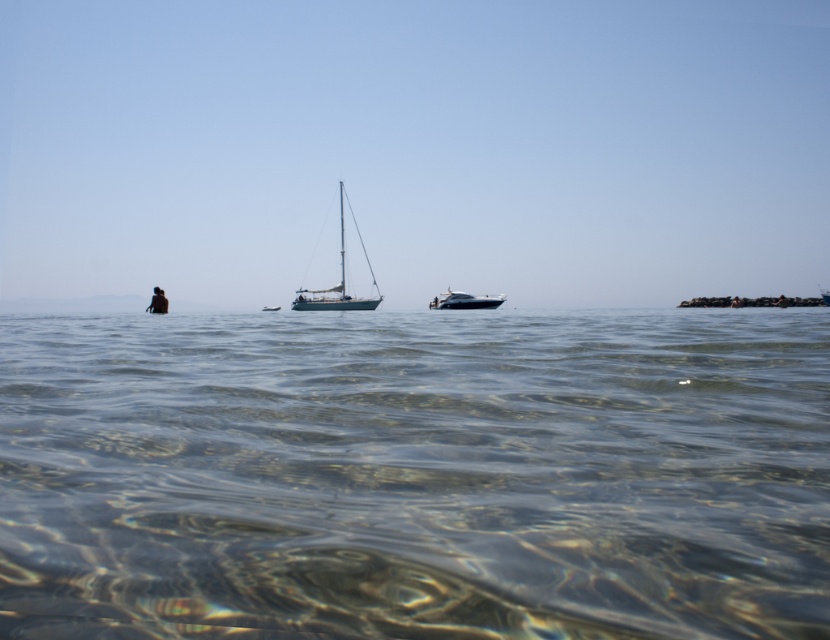
Question: Can you confirm if white glossy sailboat at center is thinner than shiny silver yacht at center?

Choices:
 (A) yes
 (B) no

Answer: (B)

Question: Is white glossy sailboat at center closer to camera compared to shiny silver yacht at center?

Choices:
 (A) no
 (B) yes

Answer: (B)

Question: Which object appears closest to the camera in this image?

Choices:
 (A) shiny silver yacht at center
 (B) white glossy sailboat at center

Answer: (B)

Question: Based on their relative distances, which object is farther from the white glossy sailboat at center?

Choices:
 (A) shiny silver yacht at center
 (B) clear water at center

Answer: (B)

Question: Can you confirm if clear water at center is bigger than white glossy sailboat at center?

Choices:
 (A) yes
 (B) no

Answer: (B)

Question: Among these objects, which one is farthest from the camera?

Choices:
 (A) clear water at center
 (B) shiny silver yacht at center

Answer: (B)